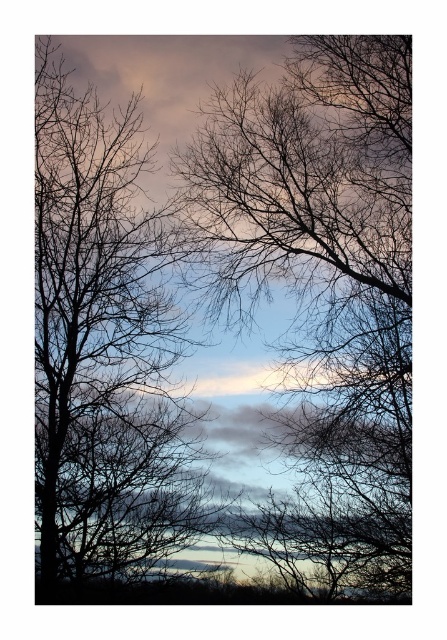
Question: Which object appears farthest from the camera in this image?

Choices:
 (A) silhouette branches at center
 (B) silhouette bare tree at left

Answer: (A)

Question: In this image, where is silhouette branches at center located relative to silhouette bare tree at left?

Choices:
 (A) right
 (B) left

Answer: (A)

Question: Where is silhouette branches at center located in relation to silhouette bare tree at left in the image?

Choices:
 (A) left
 (B) right

Answer: (B)

Question: Considering the relative positions of silhouette branches at center and silhouette bare tree at left in the image provided, where is silhouette branches at center located with respect to silhouette bare tree at left?

Choices:
 (A) above
 (B) below

Answer: (B)